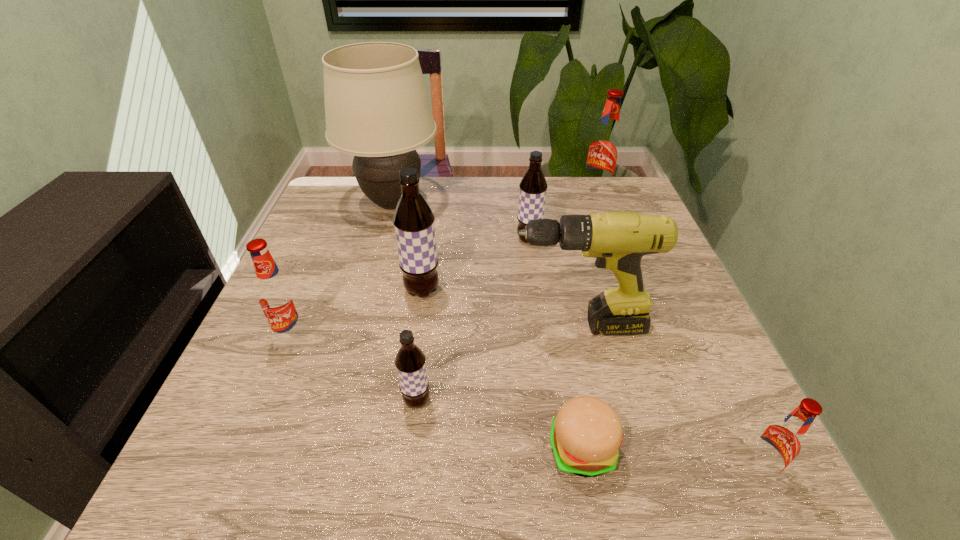
Where is `free space at the right edge of the desktop`? free space at the right edge of the desktop is located at coordinates (660, 256).

You are a GUI agent. You are given a task and a screenshot of the screen. Output one action in this format:
    pyautogui.click(x=<x>, y=<y>)
    Task: Click on the vacant space at the far right corner
    The height and width of the screenshot is (540, 960).
    Given the screenshot: What is the action you would take?
    pyautogui.click(x=607, y=197)

Where is `empty location between the biggest brown root beer and the second smallest brown root beer`? empty location between the biggest brown root beer and the second smallest brown root beer is located at coordinates (475, 265).

At what (x,y) coordinates should I click in order to perform the action: click on free space between the drill and the smallest red root beer. Please return your answer as a coordinate pair (x, y). Looking at the image, I should click on (667, 397).

Locate an element on the screen. The width and height of the screenshot is (960, 540). free spot between the hamburger and the sixth nearest object is located at coordinates (502, 370).

I want to click on unoccupied position between the third farthest root beer and the farthest brown root beer, so click(475, 265).

Locate an element on the screen. This screenshot has width=960, height=540. vacant area that lies between the hamburger and the fourth farthest object is located at coordinates (502, 370).

Locate an element on the screen. The image size is (960, 540). blank region between the tallest object and the hamburger is located at coordinates (488, 326).

You are a GUI agent. You are given a task and a screenshot of the screen. Output one action in this format:
    pyautogui.click(x=<x>, y=<y>)
    Task: Click on the vacant region between the drill and the hamburger
    
    Given the screenshot: What is the action you would take?
    pyautogui.click(x=580, y=388)

Where is `free space between the second nearest root beer and the tallest object`? The height and width of the screenshot is (540, 960). free space between the second nearest root beer and the tallest object is located at coordinates (405, 302).